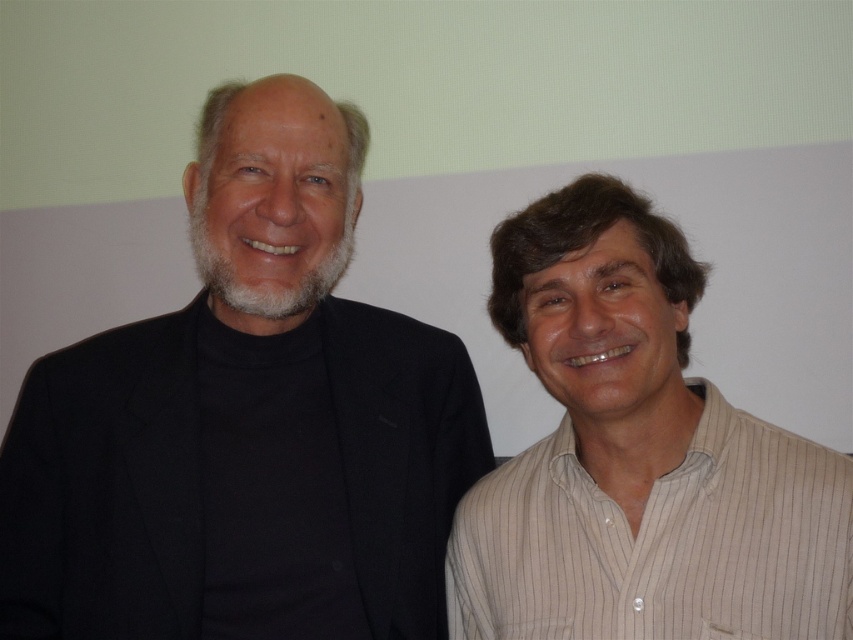
Between black matte suit at left and white striped shirt at right, which one is positioned higher?

black matte suit at left

What do you see at coordinates (241, 413) in the screenshot? I see `black matte suit at left` at bounding box center [241, 413].

Where is `black matte suit at left`? black matte suit at left is located at coordinates (241, 413).